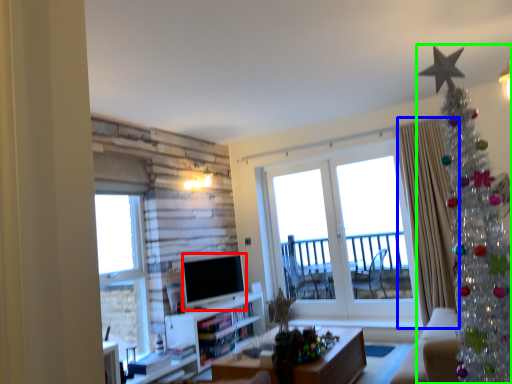
Question: Which object is the closest to the television (highlighted by a red box)? Choose among these: curtain (highlighted by a blue box) or christmas tree (highlighted by a green box).

Choices:
 (A) curtain
 (B) christmas tree

Answer: (A)